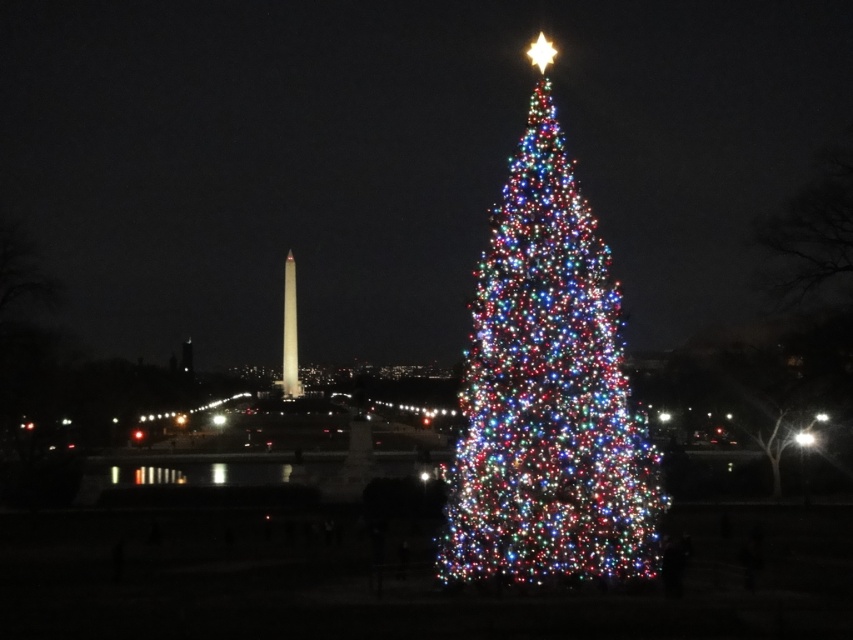
Question: Which object is closer to the camera taking this photo?

Choices:
 (A) illuminated plastic christmas tree at center
 (B) white marble obelisk at center

Answer: (A)

Question: Does illuminated plastic christmas tree at center lie in front of white marble obelisk at center?

Choices:
 (A) no
 (B) yes

Answer: (B)

Question: Is illuminated plastic christmas tree at center below white marble obelisk at center?

Choices:
 (A) yes
 (B) no

Answer: (B)

Question: Does illuminated plastic christmas tree at center have a lesser width compared to white marble obelisk at center?

Choices:
 (A) yes
 (B) no

Answer: (B)

Question: Which point is farther from the camera taking this photo?

Choices:
 (A) (299, 394)
 (B) (490, 282)

Answer: (A)